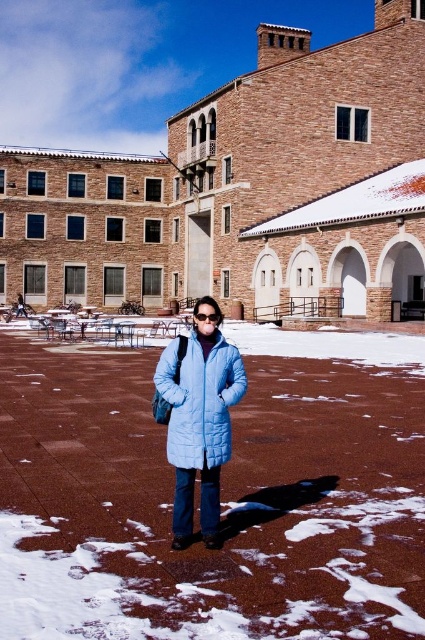
Image resolution: width=425 pixels, height=640 pixels. I want to click on light blue quilted jacket at center, so click(200, 400).

Is light blue quilted jacket at center bigger than transparent plastic goggles at center?

Yes.

Is point (201, 412) positioned after point (218, 321)?

No, (201, 412) is closer to viewer.

In order to click on light blue quilted jacket at center in this screenshot , I will do `click(200, 400)`.